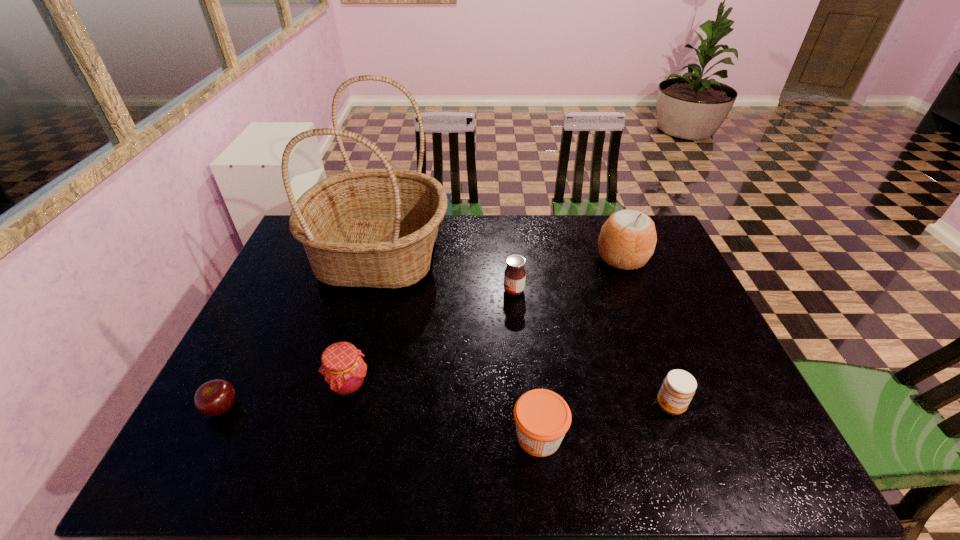
This screenshot has height=540, width=960. In order to click on free space located on the label side of the farthest jam in this screenshot , I will do `click(370, 291)`.

The height and width of the screenshot is (540, 960). What are the coordinates of `vacant area located on the back of the leftmost jam` in the screenshot? It's located at point(372,295).

Where is `vacant space located 0.050m on the front label of the rightmost jam`? Image resolution: width=960 pixels, height=540 pixels. vacant space located 0.050m on the front label of the rightmost jam is located at coordinates (683, 439).

Where is `free location located 0.090m on the front of the apple`? free location located 0.090m on the front of the apple is located at coordinates (194, 464).

The image size is (960, 540). In order to click on basket that is at the far edge in this screenshot , I will do `click(376, 228)`.

Image resolution: width=960 pixels, height=540 pixels. Identify the location of coconut at the far edge. (627, 240).

Identify the location of object that is positioned at the near edge. The height and width of the screenshot is (540, 960). (542, 417).

Locate an element on the screen. basket that is at the left edge is located at coordinates (376, 228).

The width and height of the screenshot is (960, 540). Find the location of `apple that is at the left edge`. apple that is at the left edge is located at coordinates (214, 398).

The image size is (960, 540). I want to click on coconut present at the right edge, so click(x=627, y=240).